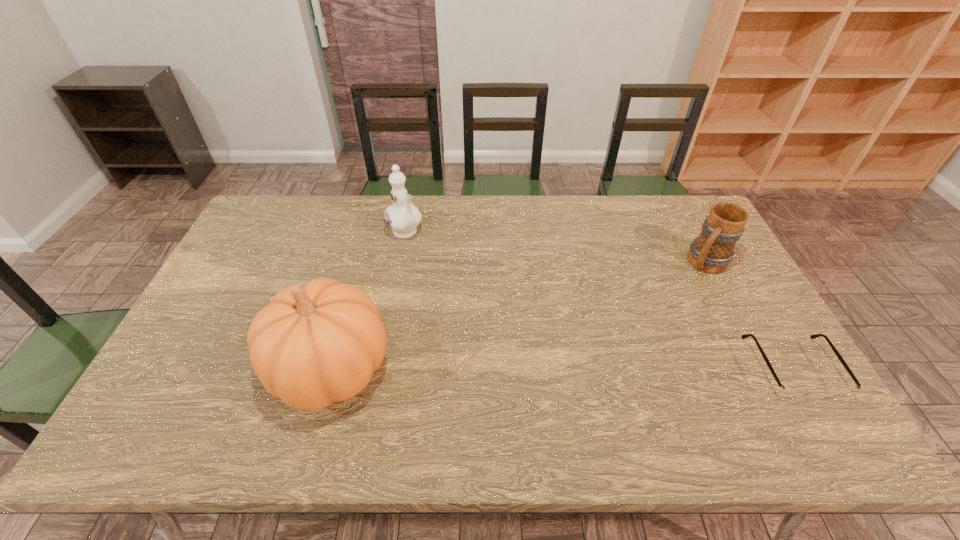
Where is `vacant space on the desktop that is between the pumpkin and the shortest object and is positioned on the side of the second farthest object with the handle`? vacant space on the desktop that is between the pumpkin and the shortest object and is positioned on the side of the second farthest object with the handle is located at coordinates (614, 369).

Image resolution: width=960 pixels, height=540 pixels. Find the location of `free space on the desktop that is between the pumpkin and the spectacles and is positioned at the spout of the chinaware`. free space on the desktop that is between the pumpkin and the spectacles and is positioned at the spout of the chinaware is located at coordinates (515, 369).